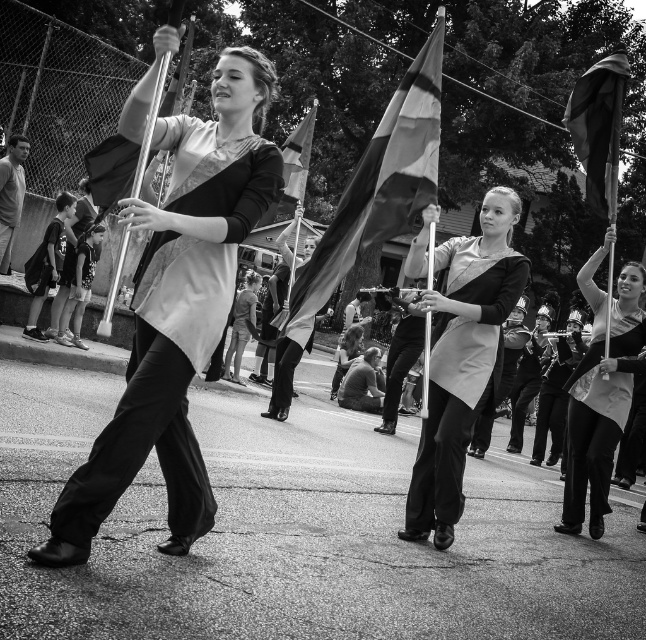
Who is higher up, smooth fabric pants at center or striped fabric flag at center?

Positioned higher is striped fabric flag at center.

Between smooth fabric pants at center and striped fabric flag at center, which one is positioned lower?

smooth fabric pants at center is below.

This screenshot has width=646, height=640. Describe the element at coordinates (284, 371) in the screenshot. I see `smooth fabric pants at center` at that location.

The height and width of the screenshot is (640, 646). Find the location of `smooth fabric pants at center`. smooth fabric pants at center is located at coordinates (284, 371).

Is point (112, 496) positioned in front of point (610, 419)?

Yes, it is.

Who is positioned more to the left, matte black flag at left or matte black flag at right?

From the viewer's perspective, matte black flag at left appears more on the left side.

Who is more distant from viewer, (x=163, y=404) or (x=579, y=380)?

The point (x=579, y=380) is more distant.

Image resolution: width=646 pixels, height=640 pixels. In order to click on matte black flag at left in this screenshot , I will do `click(178, 308)`.

Looking at this image, does smooth leather jacket at left have a smaller size compared to striped fabric flag at center?

Yes, smooth leather jacket at left is smaller than striped fabric flag at center.

Does smooth leather jacket at left have a lesser width compared to striped fabric flag at center?

Yes.

Between point (6, 161) and point (286, 200), which one is positioned behind?

The point (6, 161) is behind.

At what (x,y) coordinates should I click in order to perform the action: click on smooth leather jacket at left. Please return your answer as a coordinate pair (x, y). This screenshot has height=640, width=646. Looking at the image, I should click on pos(10,195).